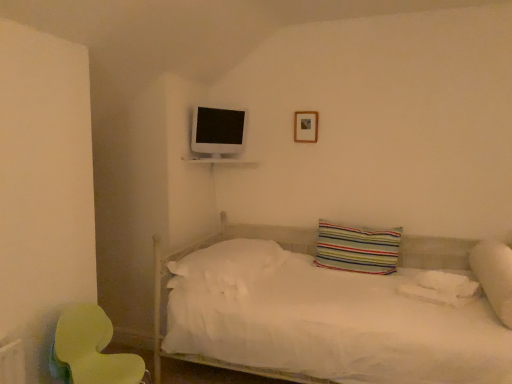
Locate an element on the screen. The image size is (512, 384). striped fabric pillow at center, which is counted as the 2th pillow, starting from the right is located at coordinates (357, 248).

The height and width of the screenshot is (384, 512). What do you see at coordinates (494, 276) in the screenshot?
I see `white soft pillow at right, which is the third pillow from left to right` at bounding box center [494, 276].

This screenshot has height=384, width=512. What do you see at coordinates (218, 161) in the screenshot?
I see `white glossy shelf at upper center` at bounding box center [218, 161].

Measure the distance between white glossy shelf at upper center and camera.

They are 10.29 feet apart.

Identify the location of green plastic swivel chair at lower left. This screenshot has width=512, height=384. (91, 350).

Is green plastic swivel chair at lower left inside the boundaries of striped fabric pillow at center, positioned as the 2th pillow in left-to-right order, or outside?

green plastic swivel chair at lower left exists outside the volume of striped fabric pillow at center, positioned as the 2th pillow in left-to-right order.

Which object is further away from the camera taking this photo, green plastic swivel chair at lower left or striped fabric pillow at center, positioned as the 2th pillow in left-to-right order?

striped fabric pillow at center, positioned as the 2th pillow in left-to-right order, is more distant.

Between green plastic swivel chair at lower left and striped fabric pillow at center, which is counted as the 2th pillow, starting from the right, which one has larger size?

Bigger between the two is green plastic swivel chair at lower left.

Is green plastic swivel chair at lower left not close to striped fabric pillow at center, which is counted as the 2th pillow, starting from the right?

Indeed, green plastic swivel chair at lower left is not near striped fabric pillow at center, which is counted as the 2th pillow, starting from the right.

Is white soft pillow at center, which is counted as the first pillow, starting from the left, not within white glossy shelf at upper center?

Yes, white soft pillow at center, which is counted as the first pillow, starting from the left, is outside of white glossy shelf at upper center.

Consider the image. Considering the relative sizes of white soft pillow at center, which is counted as the first pillow, starting from the left, and white glossy shelf at upper center in the image provided, is white soft pillow at center, which is counted as the first pillow, starting from the left, thinner than white glossy shelf at upper center?

Incorrect, the width of white soft pillow at center, which is counted as the first pillow, starting from the left, is not less than that of white glossy shelf at upper center.

Are white soft pillow at center, acting as the 3th pillow starting from the right, and white glossy shelf at upper center making contact?

No.

Considering the relative positions of white soft pillow at center, acting as the 3th pillow starting from the right, and white glossy shelf at upper center in the image provided, is white soft pillow at center, acting as the 3th pillow starting from the right, behind white glossy shelf at upper center?

No, white soft pillow at center, acting as the 3th pillow starting from the right, is closer to the viewer.

Based on their sizes in the image, would you say wooden picture frame at upper center is bigger or smaller than white glossy shelf at upper center?

Clearly, wooden picture frame at upper center is smaller in size than white glossy shelf at upper center.

What's the angular difference between wooden picture frame at upper center and white glossy shelf at upper center's facing directions?

The angular difference between wooden picture frame at upper center and white glossy shelf at upper center is 0.0398 degrees.

Is wooden picture frame at upper center oriented away from white glossy shelf at upper center?

No, wooden picture frame at upper center's orientation is not away from white glossy shelf at upper center.

From the image's perspective, which is above, wooden picture frame at upper center or white glossy shelf at upper center?

wooden picture frame at upper center.

From the image's perspective, between green plastic swivel chair at lower left and white glossy shelf at upper center, which one is located above?

white glossy shelf at upper center is shown above in the image.

Would you say white glossy shelf at upper center is part of green plastic swivel chair at lower left's contents?

Definitely not — white glossy shelf at upper center is not inside green plastic swivel chair at lower left.

Is green plastic swivel chair at lower left beside white glossy shelf at upper center?

They are not placed beside each other.

Is green plastic swivel chair at lower left oriented towards white glossy shelf at upper center?

No, green plastic swivel chair at lower left is not turned towards white glossy shelf at upper center.

Is point (94, 333) positioned before point (505, 302)?

Yes.

Is green plastic swivel chair at lower left turned away from white soft pillow at right, which is the third pillow from left to right?

No, white soft pillow at right, which is the third pillow from left to right, is not at the back of green plastic swivel chair at lower left.

Based on the photo, are green plastic swivel chair at lower left and white soft pillow at right, the first pillow in the right-to-left sequence, beside each other?

No, green plastic swivel chair at lower left is not beside white soft pillow at right, the first pillow in the right-to-left sequence.

Who is bigger, striped fabric pillow at center, positioned as the 2th pillow in left-to-right order, or white soft pillow at center, which is counted as the first pillow, starting from the left?

white soft pillow at center, which is counted as the first pillow, starting from the left, is bigger.

Who is shorter, striped fabric pillow at center, positioned as the 2th pillow in left-to-right order, or white soft pillow at center, which is counted as the first pillow, starting from the left?

Standing shorter between the two is white soft pillow at center, which is counted as the first pillow, starting from the left.

From a real-world perspective, is striped fabric pillow at center, positioned as the 2th pillow in left-to-right order, above or below white soft pillow at center, which is counted as the first pillow, starting from the left?

striped fabric pillow at center, positioned as the 2th pillow in left-to-right order, is above white soft pillow at center, which is counted as the first pillow, starting from the left.

Does striped fabric pillow at center, which is counted as the 2th pillow, starting from the right, touch white soft pillow at center, which is counted as the first pillow, starting from the left?

striped fabric pillow at center, which is counted as the 2th pillow, starting from the right, is not next to white soft pillow at center, which is counted as the first pillow, starting from the left, and they're not touching.

From a real-world perspective, between white soft pillow at center, acting as the 3th pillow starting from the right, and striped fabric pillow at center, positioned as the 2th pillow in left-to-right order, who is vertically higher?

From a 3D spatial view, striped fabric pillow at center, positioned as the 2th pillow in left-to-right order, is above.

Is white soft pillow at center, acting as the 3th pillow starting from the right, placed right next to striped fabric pillow at center, positioned as the 2th pillow in left-to-right order?

→ white soft pillow at center, acting as the 3th pillow starting from the right, is not next to striped fabric pillow at center, positioned as the 2th pillow in left-to-right order, and they're not touching.

How far apart are white soft pillow at center, which is counted as the first pillow, starting from the left, and striped fabric pillow at center, which is counted as the 2th pillow, starting from the right?

white soft pillow at center, which is counted as the first pillow, starting from the left, and striped fabric pillow at center, which is counted as the 2th pillow, starting from the right, are 58.07 centimeters apart.

Considering the relative positions of white soft pillow at center, acting as the 3th pillow starting from the right, and striped fabric pillow at center, positioned as the 2th pillow in left-to-right order, in the image provided, is white soft pillow at center, acting as the 3th pillow starting from the right, behind striped fabric pillow at center, positioned as the 2th pillow in left-to-right order,?

No, it is in front of striped fabric pillow at center, positioned as the 2th pillow in left-to-right order.

Locate an element on the screen. swivel chair below the striped fabric pillow at center, positioned as the 2th pillow in left-to-right order (from a real-world perspective) is located at coordinates (91, 350).

You are a GUI agent. You are given a task and a screenshot of the screen. Output one action in this format:
    pyautogui.click(x=<x>, y=<y>)
    Task: Click on the shelf above the white soft pillow at center, acting as the 3th pillow starting from the right (from the image's perspective)
    
    Given the screenshot: What is the action you would take?
    pyautogui.click(x=218, y=161)

Based on the photo, which object lies further to the anchor point white soft pillow at center, which is counted as the first pillow, starting from the left, striped fabric pillow at center, positioned as the 2th pillow in left-to-right order, or white glossy shelf at upper center?

Among the two, white glossy shelf at upper center is located further to white soft pillow at center, which is counted as the first pillow, starting from the left.

Which object lies nearer to the anchor point white glossy shelf at upper center, green plastic swivel chair at lower left or striped fabric pillow at center, positioned as the 2th pillow in left-to-right order?

The object closer to white glossy shelf at upper center is striped fabric pillow at center, positioned as the 2th pillow in left-to-right order.

Considering their positions, is white soft pillow at center, which is counted as the first pillow, starting from the left, positioned further to wooden picture frame at upper center than green plastic swivel chair at lower left?

The object further to wooden picture frame at upper center is green plastic swivel chair at lower left.

In the scene shown: From the image, which object appears to be farther from white soft pillow at right, which is the third pillow from left to right, white soft pillow at center, acting as the 3th pillow starting from the right, or wooden picture frame at upper center?

wooden picture frame at upper center is positioned further to the anchor white soft pillow at right, which is the third pillow from left to right.

From the image, which object appears to be farther from white soft pillow at center, which is counted as the first pillow, starting from the left, wooden picture frame at upper center or green plastic swivel chair at lower left?

wooden picture frame at upper center is further to white soft pillow at center, which is counted as the first pillow, starting from the left.

Estimate the real-world distances between objects in this image. Which object is further from white glossy shelf at upper center, striped fabric pillow at center, positioned as the 2th pillow in left-to-right order, or green plastic swivel chair at lower left?

green plastic swivel chair at lower left is positioned further to the anchor white glossy shelf at upper center.

Considering their positions, is green plastic swivel chair at lower left positioned further to white glossy shelf at upper center than white soft pillow at right, which is the third pillow from left to right?

Based on the image, white soft pillow at right, which is the third pillow from left to right, appears to be further to white glossy shelf at upper center.

In the scene shown: When comparing their distances from wooden picture frame at upper center, does white soft pillow at center, acting as the 3th pillow starting from the right, or striped fabric pillow at center, which is counted as the 2th pillow, starting from the right, seem further?

white soft pillow at center, acting as the 3th pillow starting from the right.

This screenshot has height=384, width=512. What are the coordinates of `pillow that lies between wooden picture frame at upper center and white soft pillow at center, which is counted as the first pillow, starting from the left, from top to bottom` in the screenshot? It's located at (357, 248).

You are a GUI agent. You are given a task and a screenshot of the screen. Output one action in this format:
    pyautogui.click(x=<x>, y=<y>)
    Task: Click on the pillow between green plastic swivel chair at lower left and striped fabric pillow at center, positioned as the 2th pillow in left-to-right order, in the horizontal direction
    Image resolution: width=512 pixels, height=384 pixels.
    Given the screenshot: What is the action you would take?
    pyautogui.click(x=228, y=267)

You are a GUI agent. You are given a task and a screenshot of the screen. Output one action in this format:
    pyautogui.click(x=<x>, y=<y>)
    Task: Click on the shelf between wooden picture frame at upper center and white soft pillow at center, which is counted as the first pillow, starting from the left, in the up-down direction
    
    Given the screenshot: What is the action you would take?
    pyautogui.click(x=218, y=161)

The width and height of the screenshot is (512, 384). In order to click on shelf between green plastic swivel chair at lower left and white soft pillow at right, the first pillow in the right-to-left sequence, in the horizontal direction in this screenshot , I will do `click(218, 161)`.